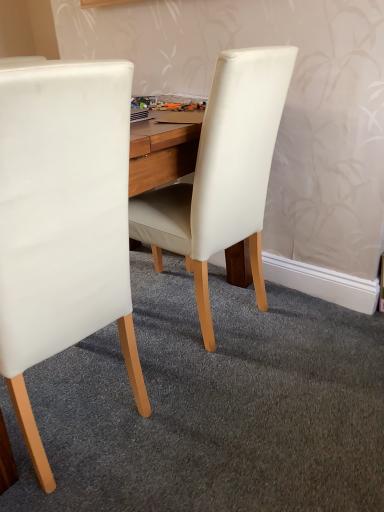
Describe the element at coordinates (223, 173) in the screenshot. I see `white leather chair at center, the 1th chair viewed from the right` at that location.

Locate an element on the screen. This screenshot has height=512, width=384. white leather chair at center, which ranks as the 2th chair in left-to-right order is located at coordinates (223, 173).

What are the coordinates of `white leather chair at left, marked as the 1th chair in a left-to-right arrangement` in the screenshot? It's located at (63, 221).

What do you see at coordinates (63, 221) in the screenshot? I see `white leather chair at left, marked as the 1th chair in a left-to-right arrangement` at bounding box center [63, 221].

What is the approximate height of white leather chair at left, the 2th chair when ordered from right to left?

It is 38.59 inches.

Image resolution: width=384 pixels, height=512 pixels. I want to click on white leather chair at center, which ranks as the 2th chair in left-to-right order, so click(223, 173).

In the scene shown: Which object is positioned more to the right, white leather chair at center, which ranks as the 2th chair in left-to-right order, or white leather chair at left, the 2th chair when ordered from right to left?

white leather chair at center, which ranks as the 2th chair in left-to-right order.

Who is more distant, white leather chair at center, which ranks as the 2th chair in left-to-right order, or white leather chair at left, marked as the 1th chair in a left-to-right arrangement?

white leather chair at center, which ranks as the 2th chair in left-to-right order.

Is point (214, 109) more distant than point (113, 296)?

Yes.

From the image's perspective, is white leather chair at center, which ranks as the 2th chair in left-to-right order, located beneath white leather chair at left, the 2th chair when ordered from right to left?

Actually, white leather chair at center, which ranks as the 2th chair in left-to-right order, appears above white leather chair at left, the 2th chair when ordered from right to left, in the image.

From a real-world perspective, does white leather chair at center, the 1th chair viewed from the right, stand above white leather chair at left, the 2th chair when ordered from right to left?

No.

Can you confirm if white leather chair at center, the 1th chair viewed from the right, is thinner than white leather chair at left, the 2th chair when ordered from right to left?

No.

From the picture: Who is shorter, white leather chair at center, which ranks as the 2th chair in left-to-right order, or white leather chair at left, the 2th chair when ordered from right to left?

white leather chair at center, which ranks as the 2th chair in left-to-right order, is shorter.

Does white leather chair at center, which ranks as the 2th chair in left-to-right order, have a smaller size compared to white leather chair at left, marked as the 1th chair in a left-to-right arrangement?

Yes.

Is white leather chair at left, the 2th chair when ordered from right to left, inside white leather chair at center, the 1th chair viewed from the right?

Definitely not — white leather chair at left, the 2th chair when ordered from right to left, is not inside white leather chair at center, the 1th chair viewed from the right.

Is white leather chair at center, which ranks as the 2th chair in left-to-right order, positioned far away from white leather chair at left, the 2th chair when ordered from right to left?

No.

Is white leather chair at center, the 1th chair viewed from the right, looking in the opposite direction of white leather chair at left, marked as the 1th chair in a left-to-right arrangement?

white leather chair at center, the 1th chair viewed from the right, does not have its back to white leather chair at left, marked as the 1th chair in a left-to-right arrangement.

Image resolution: width=384 pixels, height=512 pixels. What are the coordinates of `chair above the white leather chair at left, marked as the 1th chair in a left-to-right arrangement (from the image's perspective)` in the screenshot? It's located at (223, 173).

Based on the photo, considering the positions of objects white leather chair at left, marked as the 1th chair in a left-to-right arrangement, and white leather chair at center, which ranks as the 2th chair in left-to-right order, in the image provided, who is more to the right, white leather chair at left, marked as the 1th chair in a left-to-right arrangement, or white leather chair at center, which ranks as the 2th chair in left-to-right order,?

From the viewer's perspective, white leather chair at center, which ranks as the 2th chair in left-to-right order, appears more on the right side.

Which object is closer to the camera taking this photo, white leather chair at left, marked as the 1th chair in a left-to-right arrangement, or white leather chair at center, the 1th chair viewed from the right?

white leather chair at left, marked as the 1th chair in a left-to-right arrangement, is closer to the camera.

Considering the points (10, 69) and (259, 177), which point is in front, point (10, 69) or point (259, 177)?

The point (10, 69) is more forward.

From the image's perspective, which is below, white leather chair at left, marked as the 1th chair in a left-to-right arrangement, or white leather chair at center, the 1th chair viewed from the right?

white leather chair at left, marked as the 1th chair in a left-to-right arrangement, from the image's perspective.

From a real-world perspective, is white leather chair at left, marked as the 1th chair in a left-to-right arrangement, positioned over white leather chair at center, which ranks as the 2th chair in left-to-right order, based on gravity?

Yes, from a real-world perspective, white leather chair at left, marked as the 1th chair in a left-to-right arrangement, is on top of white leather chair at center, which ranks as the 2th chair in left-to-right order.

Considering the sizes of white leather chair at left, marked as the 1th chair in a left-to-right arrangement, and white leather chair at center, which ranks as the 2th chair in left-to-right order, in the image, is white leather chair at left, marked as the 1th chair in a left-to-right arrangement, wider or thinner than white leather chair at center, which ranks as the 2th chair in left-to-right order,?

In the image, white leather chair at left, marked as the 1th chair in a left-to-right arrangement, appears to be more narrow than white leather chair at center, which ranks as the 2th chair in left-to-right order.

Can you confirm if white leather chair at left, the 2th chair when ordered from right to left, is shorter than white leather chair at center, the 1th chair viewed from the right?

No, white leather chair at left, the 2th chair when ordered from right to left, is not shorter than white leather chair at center, the 1th chair viewed from the right.

Is white leather chair at left, the 2th chair when ordered from right to left, smaller than white leather chair at center, which ranks as the 2th chair in left-to-right order?

Actually, white leather chair at left, the 2th chair when ordered from right to left, might be larger than white leather chair at center, which ranks as the 2th chair in left-to-right order.

Is white leather chair at left, marked as the 1th chair in a left-to-right arrangement, situated inside white leather chair at center, the 1th chair viewed from the right, or outside?

white leather chair at left, marked as the 1th chair in a left-to-right arrangement, is outside white leather chair at center, the 1th chair viewed from the right.

Would you say white leather chair at left, the 2th chair when ordered from right to left, is a long distance from white leather chair at center, which ranks as the 2th chair in left-to-right order?

No, white leather chair at left, the 2th chair when ordered from right to left, is in close proximity to white leather chair at center, which ranks as the 2th chair in left-to-right order.

Is white leather chair at left, marked as the 1th chair in a left-to-right arrangement, aimed at white leather chair at center, which ranks as the 2th chair in left-to-right order?

No, white leather chair at left, marked as the 1th chair in a left-to-right arrangement, is not facing towards white leather chair at center, which ranks as the 2th chair in left-to-right order.

How different are the orientations of white leather chair at left, marked as the 1th chair in a left-to-right arrangement, and white leather chair at center, which ranks as the 2th chair in left-to-right order, in degrees?

They differ by 2.1 degrees in their facing directions.

Find the location of `chair in front of the white leather chair at center, the 1th chair viewed from the right`. chair in front of the white leather chair at center, the 1th chair viewed from the right is located at coordinates click(x=63, y=221).

Find the location of a particular element. This screenshot has width=384, height=512. chair that is above the white leather chair at center, the 1th chair viewed from the right (from a real-world perspective) is located at coordinates (63, 221).

This screenshot has height=512, width=384. Find the location of `chair below the white leather chair at left, the 2th chair when ordered from right to left (from a real-world perspective)`. chair below the white leather chair at left, the 2th chair when ordered from right to left (from a real-world perspective) is located at coordinates pos(223,173).